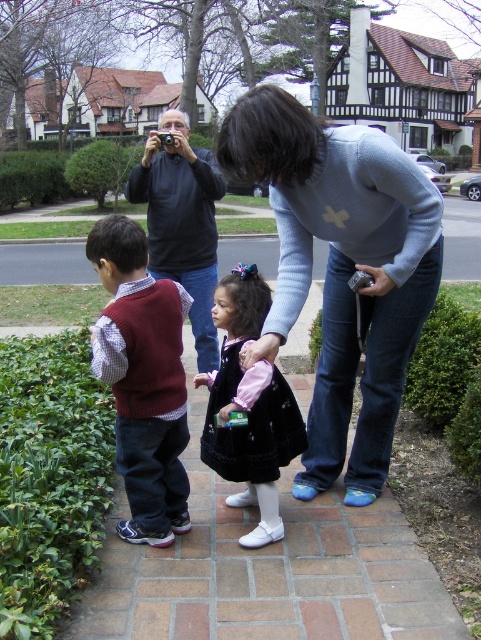
Question: Which object is positioned closest to the dark blue velvet dress at center?

Choices:
 (A) maroon sweater at left
 (B) dark gray sweater at upper left
 (C) light blue sweater at center

Answer: (A)

Question: Is light blue sweater at center thinner than dark gray sweater at upper left?

Choices:
 (A) no
 (B) yes

Answer: (A)

Question: Where is maroon sweater at left located in relation to dark gray sweater at upper left in the image?

Choices:
 (A) right
 (B) left

Answer: (A)

Question: Can you confirm if light blue sweater at center is positioned below maroon sweater at left?

Choices:
 (A) yes
 (B) no

Answer: (B)

Question: Estimate the real-world distances between objects in this image. Which object is closer to the dark blue velvet dress at center?

Choices:
 (A) dark gray sweater at upper left
 (B) maroon sweater at left

Answer: (B)

Question: Which point is closer to the camera taking this photo?

Choices:
 (A) (152, 456)
 (B) (277, 308)

Answer: (B)